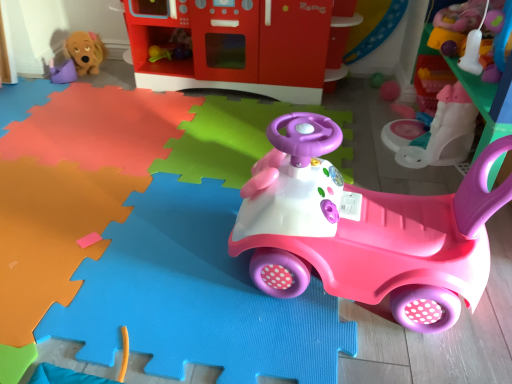
The height and width of the screenshot is (384, 512). What are the coordinates of `vacant space in front of brown plush dog at upper left, which ranks as the 2th toy in left-to-right order` in the screenshot? It's located at click(x=60, y=86).